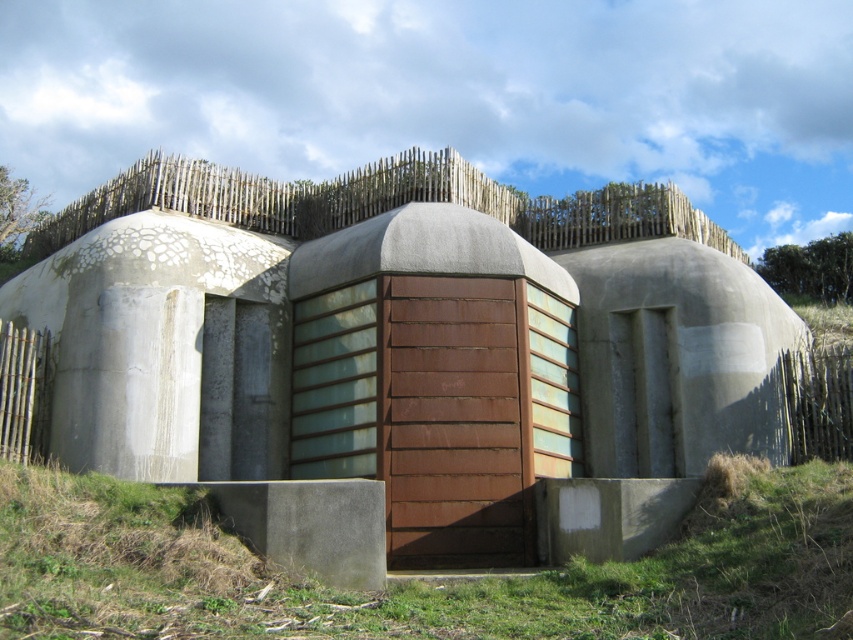
You are a maintenance worker who needs to reach the rusty metal door at center from the green grass at lower center. Given that your ladder is 35 feet long, can you safely reach the door without needing to move the ladder closer?

The rusty metal door at center and green grass at lower center are 37.87 feet apart. Since the ladder is only 35 feet long, it is not long enough to bridge the 37.87 feet distance between them. Therefore, you cannot safely reach the door without moving the ladder closer.

You are standing on the green grass at lower center and want to enter the rusty metal door at center. Which direction should you move to reach the door?

The rusty metal door at center is located above green grass at lower center, so you should move upward to reach the door.